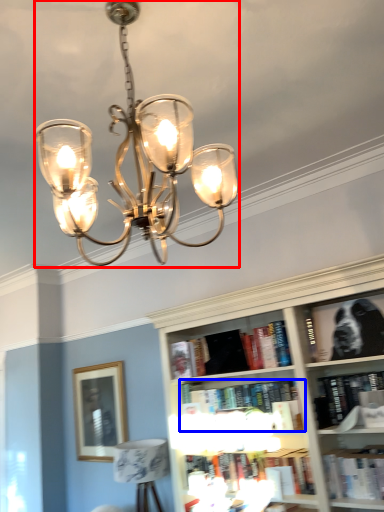
Question: Which object appears closest to the camera in this image, lamp (highlighted by a red box) or book (highlighted by a blue box)?

Choices:
 (A) lamp
 (B) book

Answer: (A)